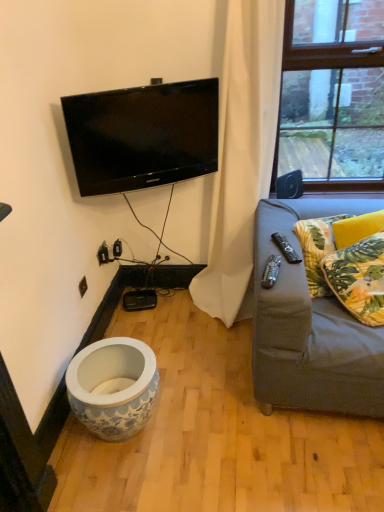
Locate an element on the screen. Image resolution: width=384 pixels, height=512 pixels. free location to the left of black plastic remote at right is located at coordinates (271, 249).